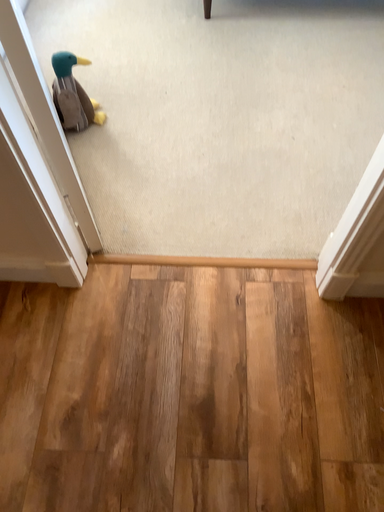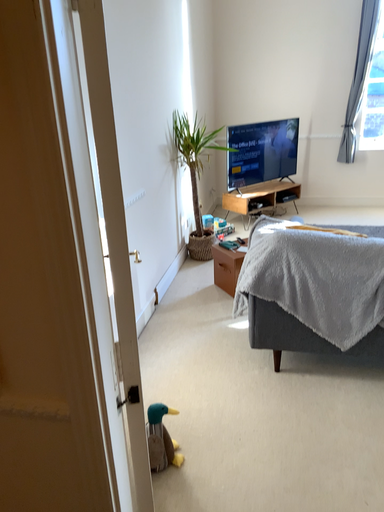
Question: How did the camera likely rotate when shooting the video?

Choices:
 (A) rotated downward
 (B) rotated upward

Answer: (B)